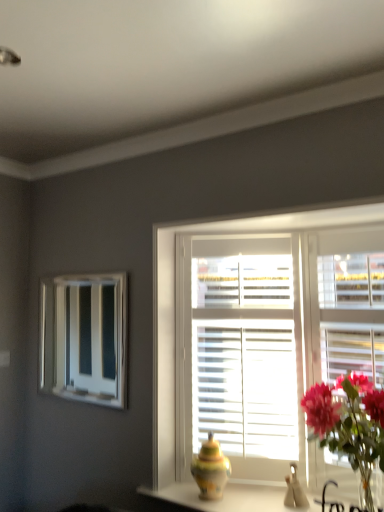
The width and height of the screenshot is (384, 512). Find the location of `vacant space to the right of multicolored ceramic vase at center`. vacant space to the right of multicolored ceramic vase at center is located at coordinates (253, 490).